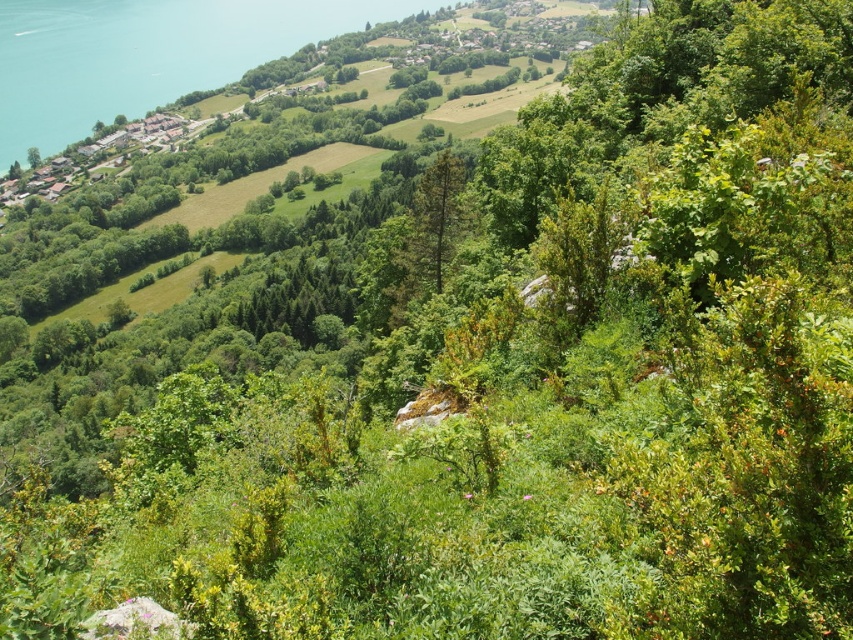
Consider the image. You are a hiker trying to cross a stream. You see the green water at left and the green matte tree at center. Which path should you take to avoid getting your shoes wet?

The green water at left is wider than the green matte tree at center, so the path near the green matte tree at center is narrower and less likely to be a deep stream. Take that path to avoid getting your shoes wet.

You are a hiker who wants to cross the green water at left and reach the green matte tree at center. Based on their sizes, which one do you think is farther away from you?

The green water at left has a larger size compared to the green matte tree at center. Since objects that are closer appear larger, the green water at left is closer, so the green matte tree at center is farther away.